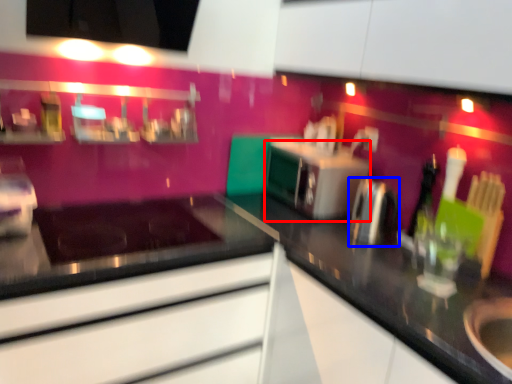
Question: Among these objects, which one is nearest to the camera, oven (highlighted by a red box) or appliance (highlighted by a blue box)?

Choices:
 (A) oven
 (B) appliance

Answer: (B)